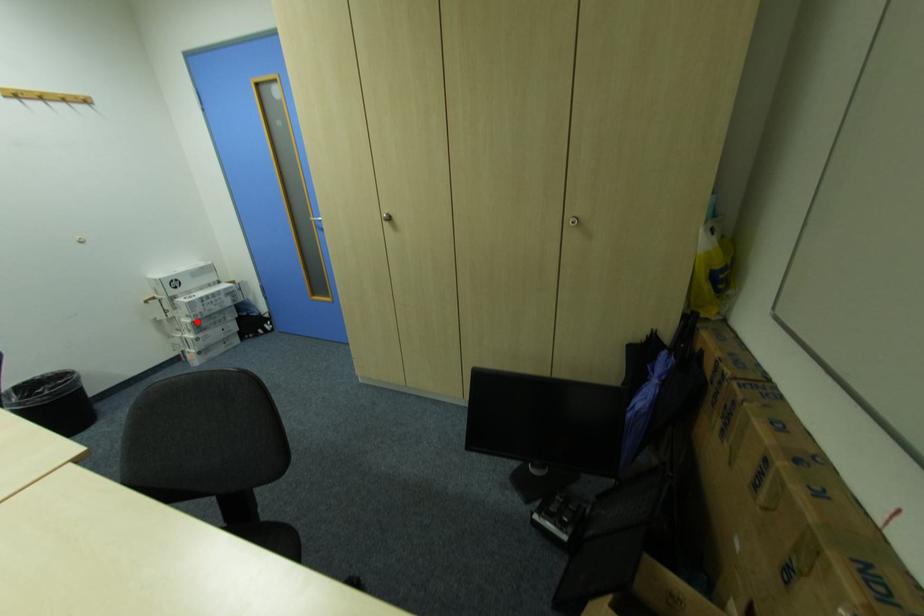
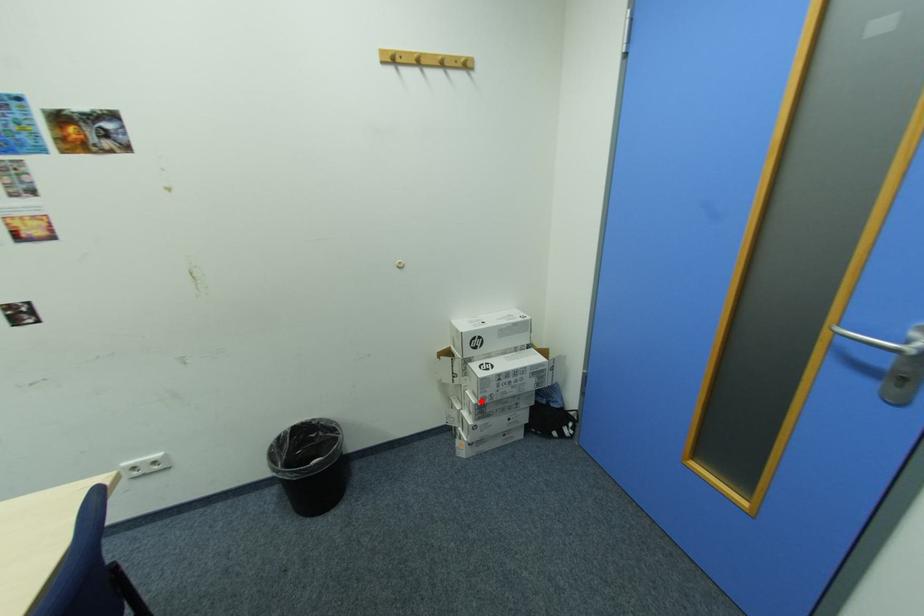
Consider the image. I am providing you with two images of the same scene from different viewpoints. A red point is marked on the first image and another point is marked on the second image. Is the red point in image1 aligned with the point shown in image2?

Yes